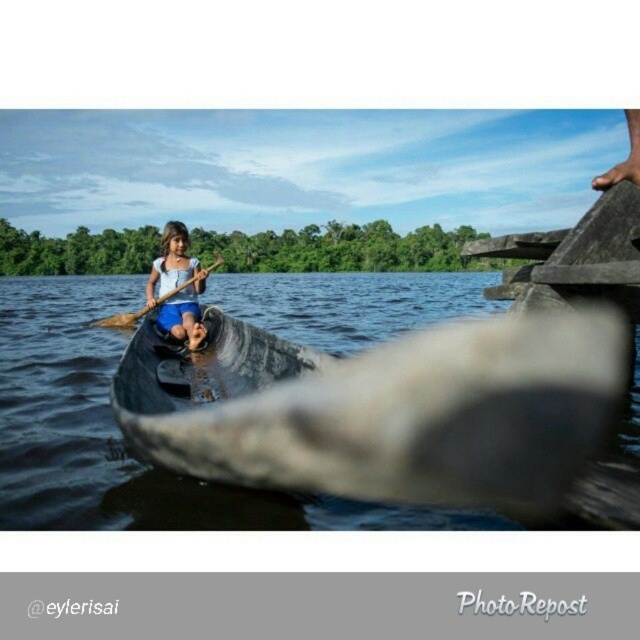
In the scene shown: Please describe the position of the matte blue dress at center in terms of coordinates within the image frame. The image frame has a coordinate system where the origin is at the bottom left corner, with x increasing to the right and y increasing upwards. Use the provided coordinates from the Objects Description to answer.

The matte blue dress at center is located at coordinates x 0.450 and y 0.278 within the image frame.

You are standing on the riverbank and see the dark gray wooden canoe at center and the matte blue dress at center. Which object is closer to the water surface?

The dark gray wooden canoe at center is positioned under the matte blue dress at center, so the canoe is closer to the water surface than the dress.

You are standing on the riverbank and see the dark gray wooden canoe at center and the matte blue dress at center. Which object is nearer to you?

The dark gray wooden canoe at center is closer to the viewer than the matte blue dress at center.